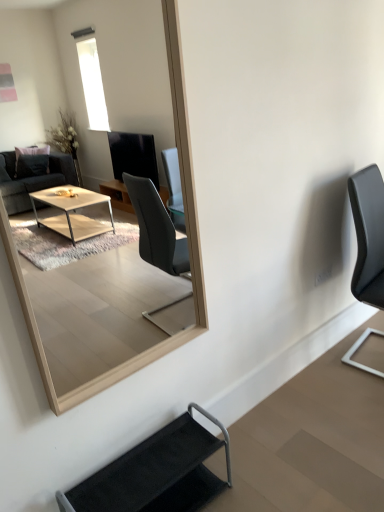
Question: Is the depth of black leather chair at right, acting as the first chair starting from the top, greater than that of black fabric chair at lower center, marked as the second chair in a right-to-left arrangement?

Choices:
 (A) no
 (B) yes

Answer: (B)

Question: From a real-world perspective, is black leather chair at right, the 1th chair positioned from the back, below black fabric chair at lower center, marked as the second chair in a right-to-left arrangement?

Choices:
 (A) no
 (B) yes

Answer: (A)

Question: Is black leather chair at right, the 2th chair viewed from the front, facing towards black fabric chair at lower center, marked as the 2th chair in a back-to-front arrangement?

Choices:
 (A) yes
 (B) no

Answer: (B)

Question: Is black leather chair at right, the 2th chair viewed from the front, outside of black fabric chair at lower center, the 2th chair positioned from the top?

Choices:
 (A) yes
 (B) no

Answer: (A)

Question: Does black leather chair at right, the 1th chair positioned from the back, have a smaller size compared to black fabric chair at lower center, marked as the 2th chair in a back-to-front arrangement?

Choices:
 (A) yes
 (B) no

Answer: (B)

Question: Does point (380, 254) appear closer or farther from the camera than point (102, 20)?

Choices:
 (A) farther
 (B) closer

Answer: (B)

Question: Is black leather chair at right, the 2th chair viewed from the front, bigger or smaller than light wood mirror at upper center?

Choices:
 (A) small
 (B) big

Answer: (B)

Question: From the image's perspective, is black leather chair at right, acting as the first chair starting from the top, above or below light wood mirror at upper center?

Choices:
 (A) above
 (B) below

Answer: (B)

Question: Is black leather chair at right, the 2th chair viewed from the front, taller or shorter than light wood mirror at upper center?

Choices:
 (A) tall
 (B) short

Answer: (B)

Question: Does point (79, 340) appear closer or farther from the camera than point (198, 409)?

Choices:
 (A) farther
 (B) closer

Answer: (A)

Question: Considering the positions of light wood mirror at upper center and black fabric chair at lower center, the 2th chair positioned from the top, in the image, is light wood mirror at upper center taller or shorter than black fabric chair at lower center, the 2th chair positioned from the top,?

Choices:
 (A) tall
 (B) short

Answer: (A)

Question: Would you say light wood mirror at upper center is inside or outside black fabric chair at lower center, the first chair from the front?

Choices:
 (A) outside
 (B) inside

Answer: (A)

Question: Is light wood mirror at upper center bigger or smaller than black fabric chair at lower center, acting as the 1th chair starting from the left?

Choices:
 (A) small
 (B) big

Answer: (B)

Question: In the image, is black fabric chair at lower center, which ranks as the first chair in bottom-to-top order, positioned in front of or behind light wood mirror at upper center?

Choices:
 (A) behind
 (B) front

Answer: (A)

Question: In the image, is black fabric chair at lower center, marked as the second chair in a right-to-left arrangement, on the left side or the right side of light wood mirror at upper center?

Choices:
 (A) right
 (B) left

Answer: (A)